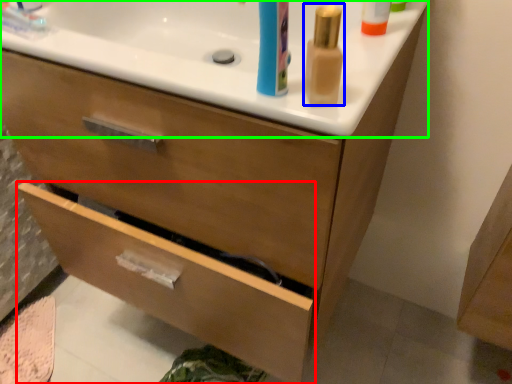
Question: Which object is positioned farthest from drawer (highlighted by a red box)? Select from mouthwash (highlighted by a blue box) and counter top (highlighted by a green box).

Choices:
 (A) mouthwash
 (B) counter top

Answer: (A)